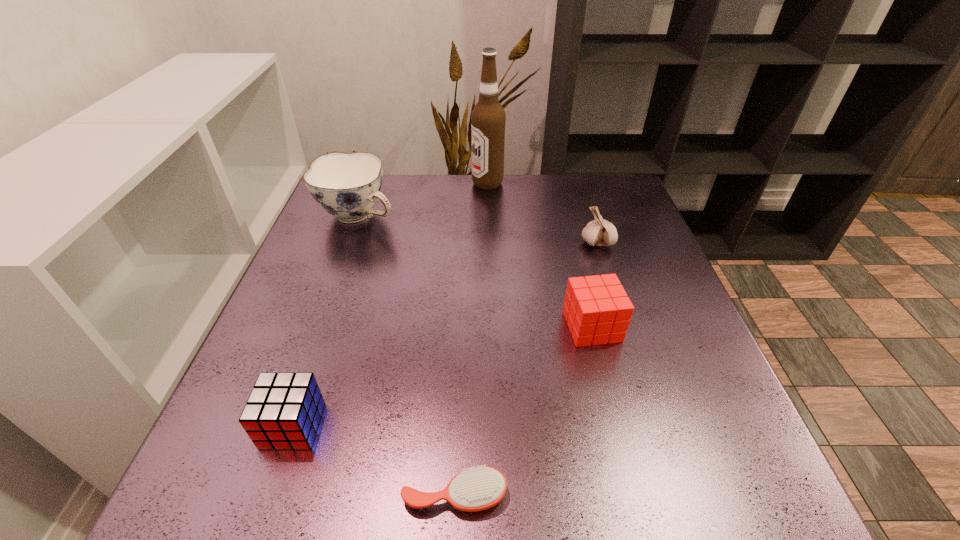
Where is `free location located on the label of the alcohol`? free location located on the label of the alcohol is located at coordinates (451, 184).

Find the location of a particular element. vacant region located 0.150m on the label of the alcohol is located at coordinates (420, 184).

Locate an element on the screen. This screenshot has width=960, height=540. vacant space situated 0.380m on the label of the alcohol is located at coordinates (343, 184).

In order to click on vacant area located 0.250m on the front of the chinaware in this screenshot , I will do `click(324, 310)`.

The image size is (960, 540). What are the coordinates of `free space located 0.120m on the back of the garlic` in the screenshot? It's located at (586, 207).

Locate an element on the screen. free region located on the left of the fourth farthest object is located at coordinates (x=470, y=327).

Find the location of a particular element. This screenshot has width=960, height=540. free space located 0.320m on the back of the left cube is located at coordinates (344, 278).

Where is `free space located on the left of the hairbrush`? This screenshot has height=540, width=960. free space located on the left of the hairbrush is located at coordinates (252, 495).

The image size is (960, 540). In order to click on alcohol that is at the far edge in this screenshot , I will do `click(488, 118)`.

This screenshot has width=960, height=540. In order to click on chinaware that is at the far edge in this screenshot , I will do `click(347, 186)`.